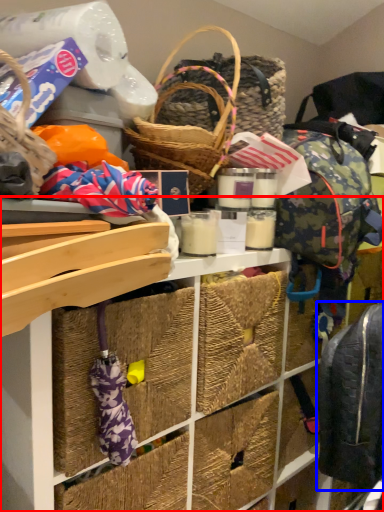
Question: Which object is closer to the camera taking this photo, shelf (highlighted by a red box) or backpack (highlighted by a blue box)?

Choices:
 (A) shelf
 (B) backpack

Answer: (A)